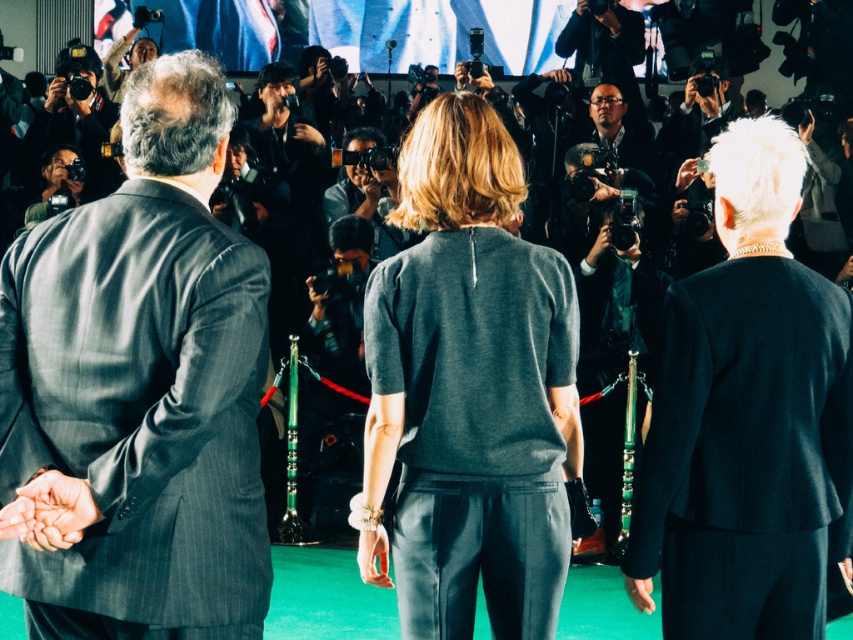
Which is behind, point (370, 182) or point (28, 205)?

The point (28, 205) is more distant.

Based on the photo, is matte black camera at center to the right of matte black camera at lower left from the viewer's perspective?

Yes, matte black camera at center is to the right of matte black camera at lower left.

Is point (360, 150) farther from viewer compared to point (45, 172)?

No, (360, 150) is closer to viewer.

Identify the location of matte black camera at center. (369, 205).

Is the position of gray pinstripe suit at left less distant than that of dark blue suit at right?

Yes.

Is point (67, 244) farther from viewer compared to point (762, 497)?

No, (67, 244) is closer to viewer.

Image resolution: width=853 pixels, height=640 pixels. I want to click on gray pinstripe suit at left, so click(138, 388).

Which is more to the left, gray pinstripe suit at left or dark gray sweater at center?

gray pinstripe suit at left

Based on the photo, does gray pinstripe suit at left have a lesser width compared to dark gray sweater at center?

No, gray pinstripe suit at left is not thinner than dark gray sweater at center.

Does point (51, 600) lie in front of point (369, 426)?

Yes, point (51, 600) is in front of point (369, 426).

You are a GUI agent. You are given a task and a screenshot of the screen. Output one action in this format:
    pyautogui.click(x=<x>, y=<y>)
    Task: Click on the gray pinstripe suit at left
    
    Given the screenshot: What is the action you would take?
    pyautogui.click(x=138, y=388)